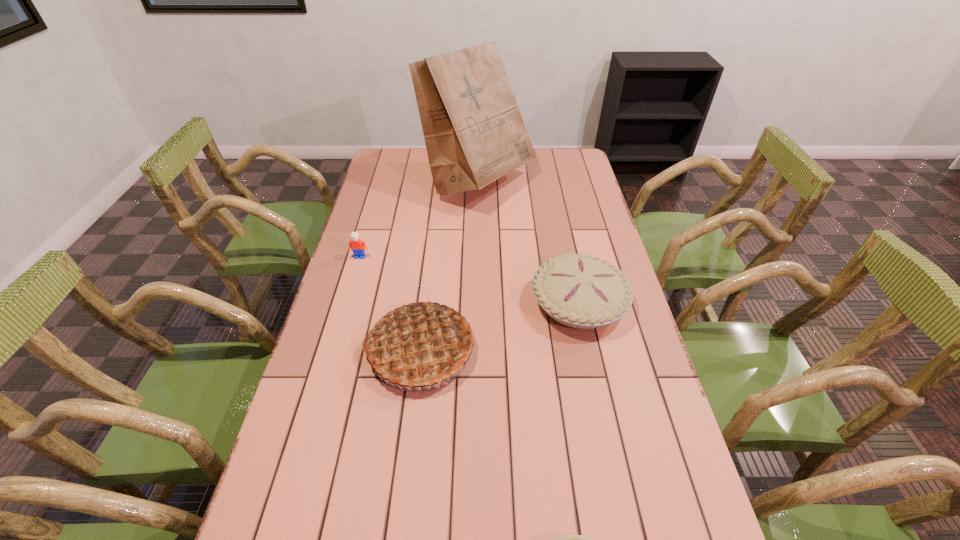
Locate an element on the screen. vacant space positioned on the face of the leftmost object is located at coordinates (354, 275).

This screenshot has width=960, height=540. What are the coordinates of `object that is at the far edge` in the screenshot? It's located at (474, 133).

This screenshot has height=540, width=960. Identify the location of pie present at the left edge. (420, 345).

Identify the location of Lego present at the left edge. (356, 245).

Locate an element on the screen. object that is at the right edge is located at coordinates (580, 291).

In the image, there is a desktop. Where is `free space at the far edge`? The image size is (960, 540). free space at the far edge is located at coordinates (526, 172).

Find the location of `vacant space at the right edge`. vacant space at the right edge is located at coordinates (569, 195).

Locate an element on the screen. free space at the far left corner of the desktop is located at coordinates (401, 176).

In order to click on vacant space in between the leftmost pie and the second shortest pie in this screenshot , I will do `click(499, 326)`.

The image size is (960, 540). Identify the location of vacant space that is in between the second shortest pie and the farthest object. (529, 241).